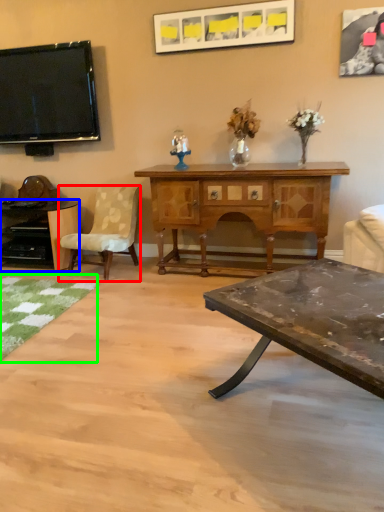
Question: Estimate the real-world distances between objects in this image. Which object is closer to chair (highlighted by a red box), desk (highlighted by a blue box) or mat (highlighted by a green box)?

Choices:
 (A) desk
 (B) mat

Answer: (A)